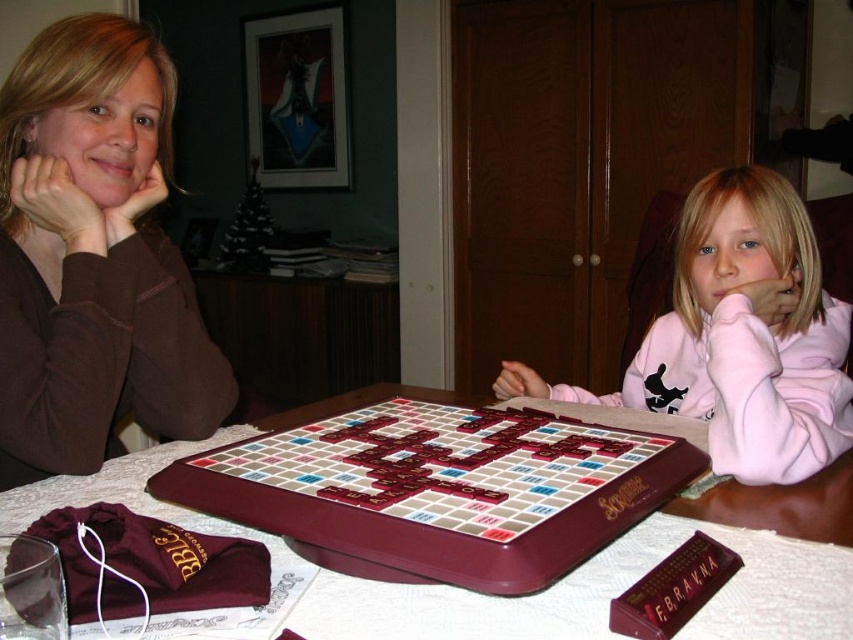
Based on the photo, can you confirm if pink fleece sweatshirt at right is thinner than maroon plastic scrabble board at center?

In fact, pink fleece sweatshirt at right might be wider than maroon plastic scrabble board at center.

Which is more to the right, pink fleece sweatshirt at right or maroon plastic scrabble board at center?

pink fleece sweatshirt at right

Find the location of a particular element. pink fleece sweatshirt at right is located at coordinates (740, 336).

You are a GUI agent. You are given a task and a screenshot of the screen. Output one action in this format:
    pyautogui.click(x=<x>, y=<y>)
    Task: Click on the pink fleece sweatshirt at right
    
    Given the screenshot: What is the action you would take?
    pyautogui.click(x=740, y=336)

Does pink fleece sweatshirt at right have a smaller size compared to maroon wooden table at center?

Actually, pink fleece sweatshirt at right might be larger than maroon wooden table at center.

Locate an element on the screen. This screenshot has height=640, width=853. pink fleece sweatshirt at right is located at coordinates (740, 336).

Locate an element on the screen. The image size is (853, 640). pink fleece sweatshirt at right is located at coordinates [x=740, y=336].

In the scene shown: Does brown fabric at left appear on the right side of pink fleece sweatshirt at right?

In fact, brown fabric at left is to the left of pink fleece sweatshirt at right.

Can you confirm if brown fabric at left is thinner than pink fleece sweatshirt at right?

Yes, brown fabric at left is thinner than pink fleece sweatshirt at right.

Identify the location of brown fabric at left. This screenshot has width=853, height=640. [x=93, y=257].